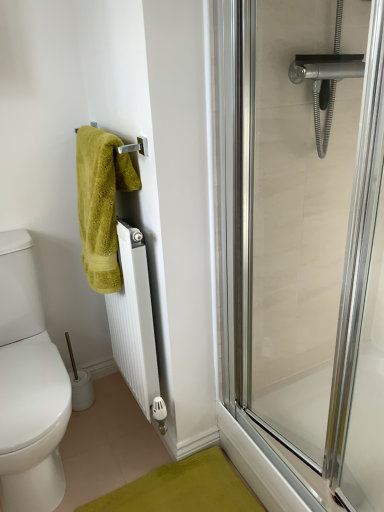
The image size is (384, 512). Identify the location of white plastic toilet paper at lower left. (79, 383).

The image size is (384, 512). What are the coordinates of `clear glass shower door at right` in the screenshot? It's located at (304, 237).

Who is taller, green fuzzy towel at upper left or white matte radiator at center?

white matte radiator at center is taller.

Does point (93, 133) lie in front of point (120, 234)?

Yes, point (93, 133) is closer to viewer.

Considering the sizes of green fuzzy towel at upper left and white matte radiator at center in the image, is green fuzzy towel at upper left bigger or smaller than white matte radiator at center?

In the image, green fuzzy towel at upper left appears to be smaller than white matte radiator at center.

Between green fuzzy towel at upper left and white matte radiator at center, which one appears on the left side from the viewer's perspective?

green fuzzy towel at upper left.

Can we say white plastic toilet paper at lower left lies outside clear glass shower door at right?

Yes, white plastic toilet paper at lower left is outside of clear glass shower door at right.

From a real-world perspective, is white plastic toilet paper at lower left beneath clear glass shower door at right?

Yes, from a real-world perspective, white plastic toilet paper at lower left is under clear glass shower door at right.

What's the angular difference between white plastic toilet paper at lower left and clear glass shower door at right's facing directions?

The angle between the facing direction of white plastic toilet paper at lower left and the facing direction of clear glass shower door at right is 79.8 degrees.

Considering the relative sizes of white plastic toilet paper at lower left and clear glass shower door at right in the image provided, is white plastic toilet paper at lower left thinner than clear glass shower door at right?

No.

Does white matte radiator at center appear on the right side of white plastic toilet paper at lower left?

Yes, white matte radiator at center is to the right of white plastic toilet paper at lower left.

Is white matte radiator at center facing towards white plastic toilet paper at lower left?

Yes, white matte radiator at center is aimed at white plastic toilet paper at lower left.

How different are the orientations of white matte radiator at center and white plastic toilet paper at lower left in degrees?

They differ by 89.8 degrees in their facing directions.

Identify the location of radiator in front of the white plastic toilet paper at lower left. (134, 320).

Can we say white matte radiator at center lies outside green fuzzy towel at upper left?

Indeed, white matte radiator at center is completely outside green fuzzy towel at upper left.

Between white matte radiator at center and green fuzzy towel at upper left, which one appears on the right side from the viewer's perspective?

From the viewer's perspective, white matte radiator at center appears more on the right side.

How different are the orientations of white matte radiator at center and green fuzzy towel at upper left in degrees?

white matte radiator at center and green fuzzy towel at upper left are facing 0.00699 degrees away from each other.

Which object is closer to the camera taking this photo, white matte radiator at center or green fuzzy towel at upper left?

green fuzzy towel at upper left is more forward.

Does white plastic toilet paper at lower left have a lesser height compared to green fuzzy towel at upper left?

Yes.

Which of these two, white plastic toilet paper at lower left or green fuzzy towel at upper left, is wider?

green fuzzy towel at upper left is wider.

Do you think white plastic toilet paper at lower left is within green fuzzy towel at upper left, or outside of it?

white plastic toilet paper at lower left is not enclosed by green fuzzy towel at upper left.

Between white plastic toilet paper at lower left and white matte radiator at center, which one appears on the left side from the viewer's perspective?

white plastic toilet paper at lower left.

Is white plastic toilet paper at lower left inside or outside of white matte radiator at center?

white plastic toilet paper at lower left lies outside white matte radiator at center.

From the image's perspective, between white plastic toilet paper at lower left and white matte radiator at center, who is located below?

white plastic toilet paper at lower left.

Who is smaller, green fuzzy towel at upper left or clear glass shower door at right?

Smaller between the two is green fuzzy towel at upper left.

Considering the relative sizes of green fuzzy towel at upper left and clear glass shower door at right in the image provided, is green fuzzy towel at upper left taller than clear glass shower door at right?

Result: In fact, green fuzzy towel at upper left may be shorter than clear glass shower door at right.

Is green fuzzy towel at upper left behind clear glass shower door at right?

Yes, it is.

You are a GUI agent. You are given a task and a screenshot of the screen. Output one action in this format:
    pyautogui.click(x=<x>, y=<y>)
    Task: Click on the radiator on the right of green fuzzy towel at upper left
    This screenshot has height=512, width=384.
    Given the screenshot: What is the action you would take?
    pyautogui.click(x=134, y=320)

Where is `screen door located above the white plastic toilet paper at lower left (from the image's perspective)`? screen door located above the white plastic toilet paper at lower left (from the image's perspective) is located at coordinates (304, 237).

From the image, which object appears to be nearer to green fuzzy towel at upper left, white matte radiator at center or white plastic toilet paper at lower left?

white matte radiator at center is positioned closer to the anchor green fuzzy towel at upper left.

Considering their positions, is white plastic toilet paper at lower left positioned further to clear glass shower door at right than white matte radiator at center?

The object further to clear glass shower door at right is white plastic toilet paper at lower left.

Based on their spatial positions, is white plastic toilet paper at lower left or clear glass shower door at right further from green fuzzy towel at upper left?

white plastic toilet paper at lower left lies further to green fuzzy towel at upper left than the other object.

Based on their spatial positions, is green fuzzy towel at upper left or clear glass shower door at right closer to white plastic toilet paper at lower left?

green fuzzy towel at upper left is positioned closer to the anchor white plastic toilet paper at lower left.

Which object lies nearer to the anchor point green fuzzy towel at upper left, clear glass shower door at right or white matte radiator at center?

white matte radiator at center.

Considering their positions, is white matte radiator at center positioned closer to clear glass shower door at right than white plastic toilet paper at lower left?

white matte radiator at center lies closer to clear glass shower door at right than the other object.

Looking at this image, from the image, which object appears to be farther from green fuzzy towel at upper left, white matte radiator at center or clear glass shower door at right?

Among the two, clear glass shower door at right is located further to green fuzzy towel at upper left.

When comparing their distances from white plastic toilet paper at lower left, does clear glass shower door at right or white matte radiator at center seem further?

clear glass shower door at right is positioned further to the anchor white plastic toilet paper at lower left.

At what (x,y) coordinates should I click in order to perform the action: click on radiator positioned between clear glass shower door at right and white plastic toilet paper at lower left from near to far. Please return your answer as a coordinate pair (x, y). Looking at the image, I should click on (134, 320).

In order to click on radiator between green fuzzy towel at upper left and clear glass shower door at right in the horizontal direction in this screenshot , I will do `click(134, 320)`.

What are the coordinates of `towel between clear glass shower door at right and white plastic toilet paper at lower left in the front-back direction` in the screenshot? It's located at (101, 204).

At what (x,y) coordinates should I click in order to perform the action: click on radiator that lies between green fuzzy towel at upper left and white plastic toilet paper at lower left from top to bottom. Please return your answer as a coordinate pair (x, y). Looking at the image, I should click on (134, 320).